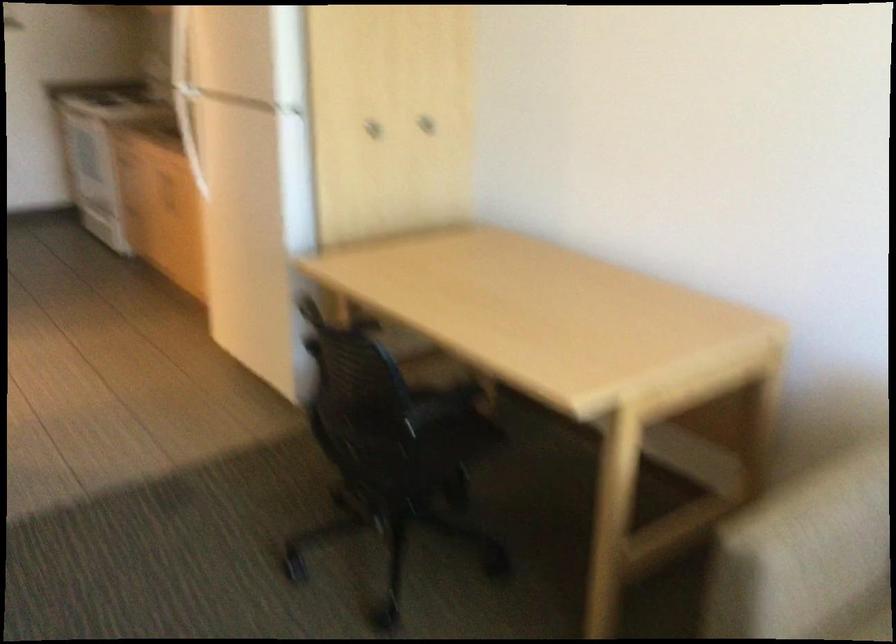
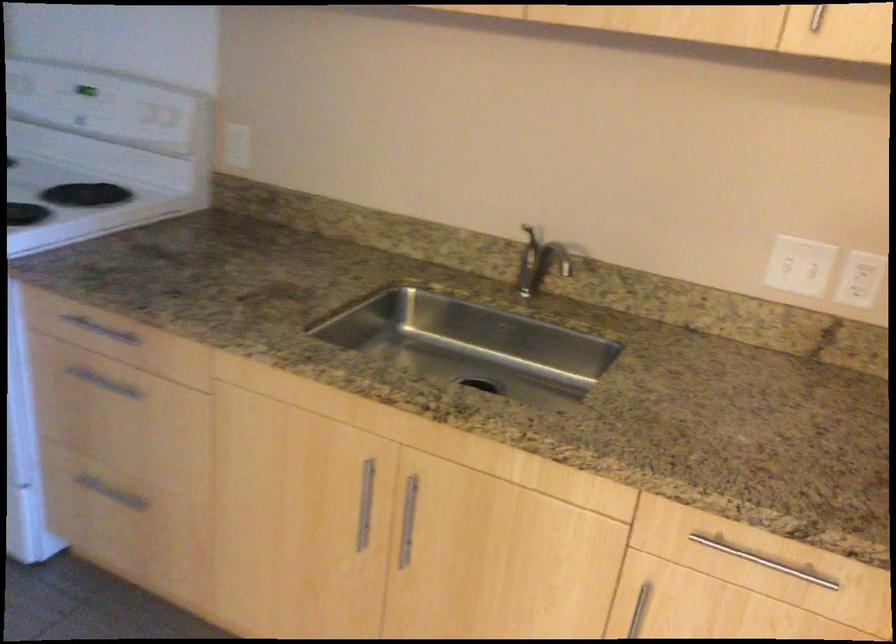
Find the pixel in the second image that matches the point at 194,196 in the first image.

(408, 520)